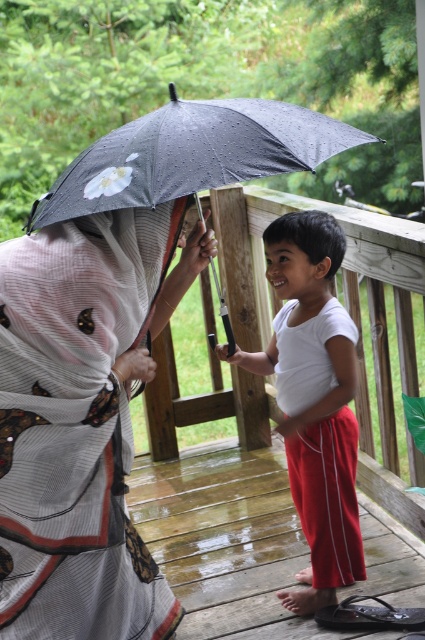
Consider the image. You are a photographer trying to capture a closeup of the matte gray scarf at upper left and the black dotted umbrella at center. Which object should you focus on first to ensure it appears sharp in the photo?

The matte gray scarf at upper left is closer to the viewer than the black dotted umbrella at center, so you should focus on the matte gray scarf at upper left first to ensure it appears sharp.

You are an observer standing in front of the scene. You notice the matte gray scarf at upper left and the black dotted umbrella at center. Which object takes up more space in the image?

The matte gray scarf at upper left is bigger than the black dotted umbrella at center, so it takes up more space in the image.

You are a photographer trying to capture the scene of the two individuals on the wooden deck. You want to ensure the matte gray scarf at upper left and the black dotted umbrella at center are both in focus. Since you can only focus on one object at a time, which object should you prioritize focusing on to ensure the other is also in focus?

You should focus on the black dotted umbrella at center because the matte gray scarf at upper left is to the left of it, so keeping the umbrella in focus will naturally include the scarf within the depth of field.